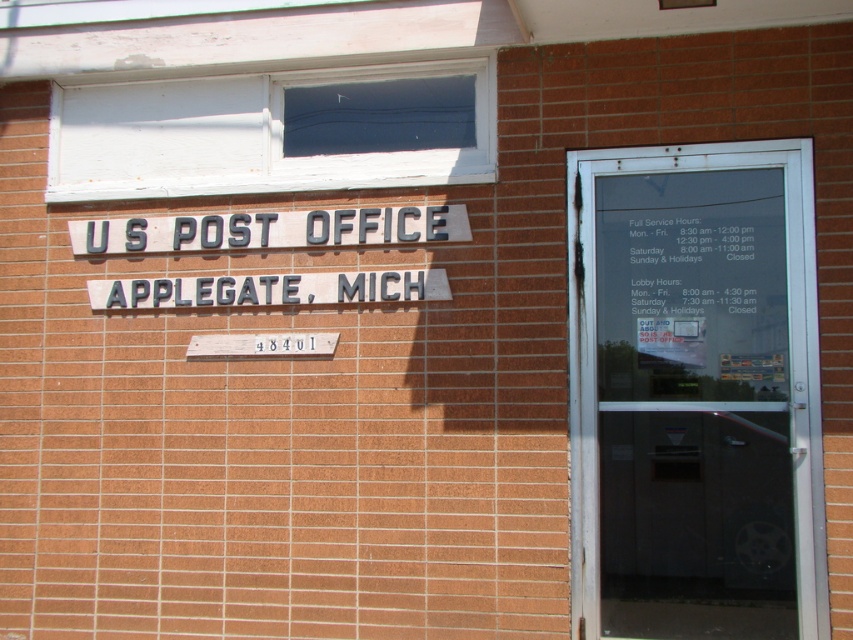
Question: Does white painted wood window at upper center appear on the left side of gray metallic sign at upper center?

Choices:
 (A) yes
 (B) no

Answer: (B)

Question: Is the position of transparent glass door at center more distant than that of white painted wood window at upper center?

Choices:
 (A) no
 (B) yes

Answer: (A)

Question: Which point is farther to the camera?

Choices:
 (A) (328, 113)
 (B) (285, 230)

Answer: (A)

Question: Based on their relative distances, which object is farther from the white painted wood window at upper center?

Choices:
 (A) transparent glass door at center
 (B) gray metallic sign at upper center

Answer: (A)

Question: Which point is farther from the camera taking this photo?

Choices:
 (A) (415, 214)
 (B) (740, 224)

Answer: (A)

Question: Is transparent glass door at center wider than gray metallic sign at upper center?

Choices:
 (A) no
 (B) yes

Answer: (A)